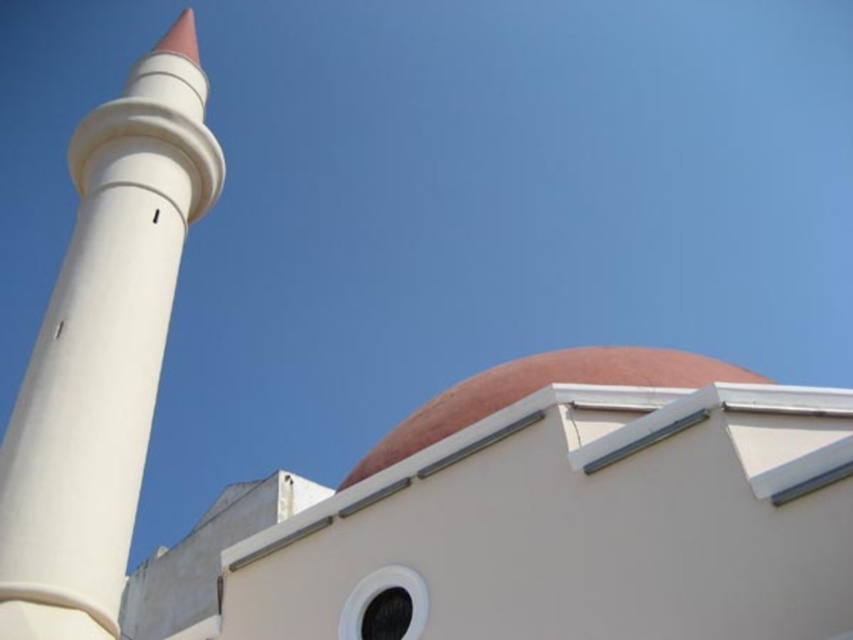
Does white smooth minaret at left appear under matte pink dome at center?

Actually, white smooth minaret at left is above matte pink dome at center.

Can you confirm if white smooth minaret at left is positioned to the left of matte pink dome at center?

Correct, you'll find white smooth minaret at left to the left of matte pink dome at center.

Between point (154, 65) and point (524, 362), which one is positioned behind?

Positioned behind is point (154, 65).

Locate an element on the screen. Image resolution: width=853 pixels, height=640 pixels. white smooth minaret at left is located at coordinates (103, 349).